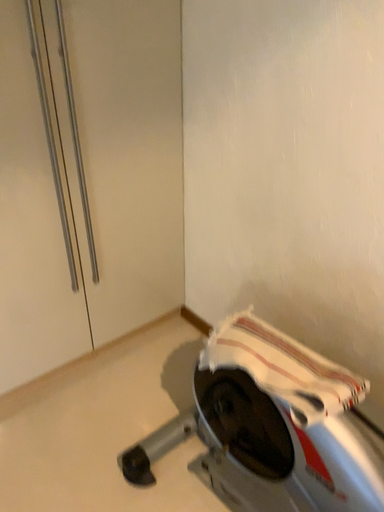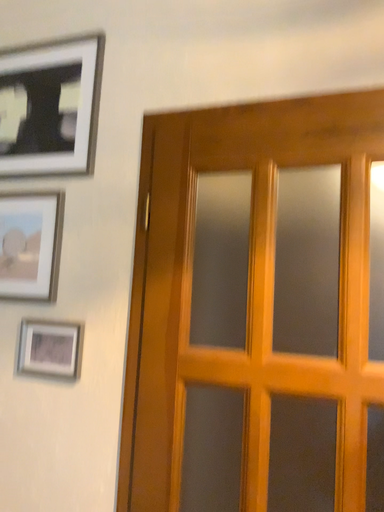
Question: Which way did the camera rotate in the video?

Choices:
 (A) rotated upward
 (B) rotated downward

Answer: (A)